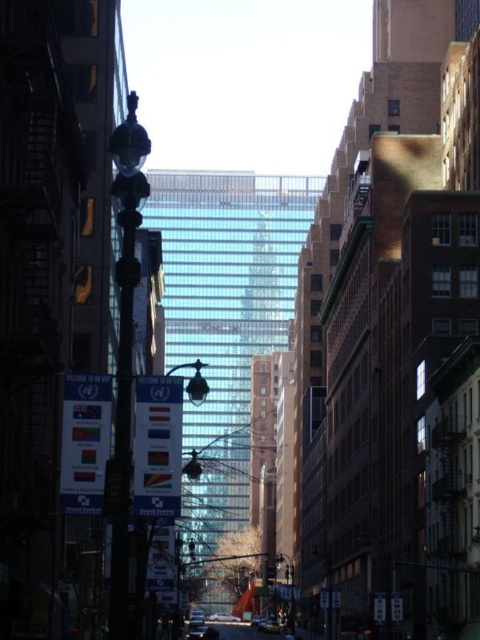
Is point (291, 609) farther from camera compared to point (215, 614)?

No, (291, 609) is closer to viewer.

Who is more forward, [287,627] or [226,616]?

Point [287,627]

You are a GUI agent. You are given a task and a screenshot of the screen. Output one action in this format:
    pyautogui.click(x=<x>, y=<y>)
    Task: Click on the black glass lamp post at center
    Image resolution: width=480 pixels, height=640 pixels.
    Given the screenshot: What is the action you would take?
    pyautogui.click(x=287, y=588)

The width and height of the screenshot is (480, 640). In order to click on black glass lamp post at center in this screenshot , I will do `click(287, 588)`.

You are a GUI agent. You are given a task and a screenshot of the screen. Output one action in this format:
    pyautogui.click(x=<x>, y=<y>)
    Task: Click on the metallic streetlamp at center
    The height and width of the screenshot is (640, 480).
    Given the screenshot: What is the action you would take?
    pyautogui.click(x=162, y=440)

Is metallic streetlamp at center positioned at the back of metallic silver car at center?

No, metallic streetlamp at center is in front of metallic silver car at center.

The width and height of the screenshot is (480, 640). I want to click on metallic streetlamp at center, so click(162, 440).

The height and width of the screenshot is (640, 480). In order to click on metallic streetlamp at center in this screenshot , I will do `click(162, 440)`.

Between point (288, 611) and point (190, 628), which one is positioned behind?

Point (288, 611)

What are the coordinates of `black glass lamp post at center` in the screenshot? It's located at (287, 588).

Does point (276, 564) come behind point (195, 627)?

Yes.

Where is `black glass lamp post at center`? The width and height of the screenshot is (480, 640). black glass lamp post at center is located at coordinates (287, 588).